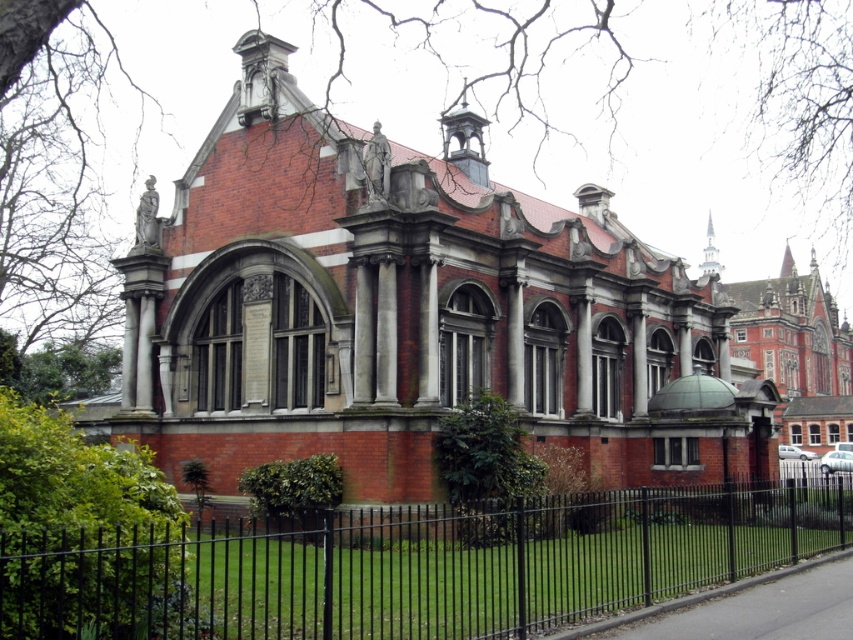
Question: Which point is closer to the camera?

Choices:
 (A) (132, 632)
 (B) (473, 332)

Answer: (A)

Question: Among these objects, which one is nearest to the camera?

Choices:
 (A) red brick church at center
 (B) black metal fence at lower center

Answer: (B)

Question: Considering the relative positions of red brick church at center and black metal fence at lower center in the image provided, where is red brick church at center located with respect to black metal fence at lower center?

Choices:
 (A) above
 (B) below

Answer: (A)

Question: Does red brick church at center have a smaller size compared to black metal fence at lower center?

Choices:
 (A) yes
 (B) no

Answer: (B)

Question: Does red brick church at center have a greater width compared to black metal fence at lower center?

Choices:
 (A) yes
 (B) no

Answer: (A)